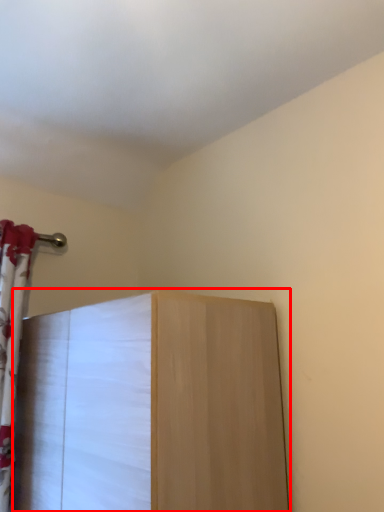
Question: From the image's perspective, considering the relative positions of furniture (annotated by the red box) and curtain in the image provided, where is furniture (annotated by the red box) located with respect to the staircase?

Choices:
 (A) above
 (B) below

Answer: (B)